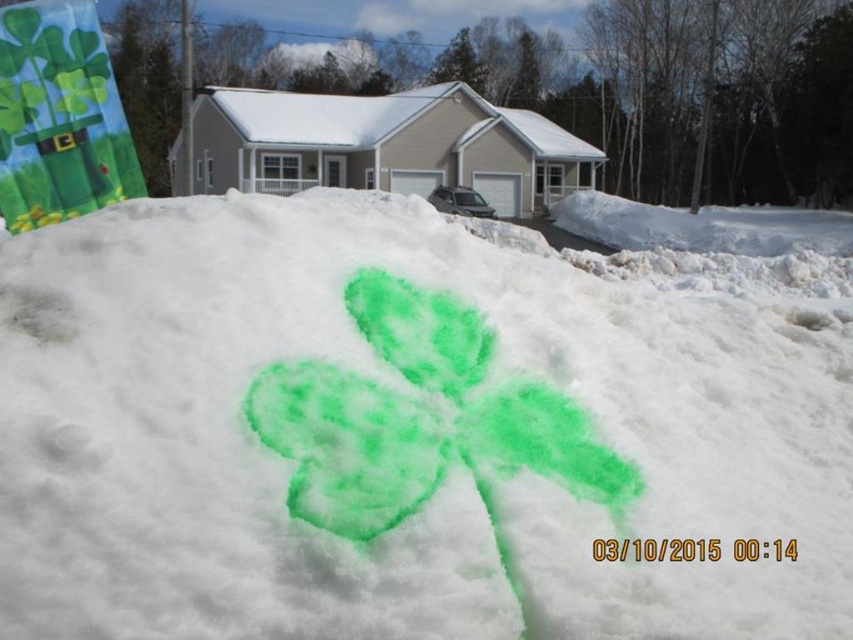
You are standing at the entrance of the house and want to find the green powder at center. According to the coordinates provided, in which direction should you look to locate it?

The green powder at center is located at coordinates point (419, 424), which means you should look towards the lower right direction from your position at the entrance to find it.

You are a painter who wants to add a new design on the snow. You have two green powders available. The first is labeled as green powder at center, and the second is green powder clover at center. According to the scene, which green powder is placed on top of the other?

The green powder at center is positioned over the green powder clover at center, so the green powder at center is on top.

Based on the photo, you are an artist who wants to paint a clover on the snow. You have two green powders available. The first is labeled as green powder at center, and the second is labeled as green powder clover at center. Based on the scene, which powder should you use to create a taller clover on the snow mound?

The green powder at center has a greater height compared to the green powder clover at center, so you should use the green powder at center to create a taller clover on the snow mound.